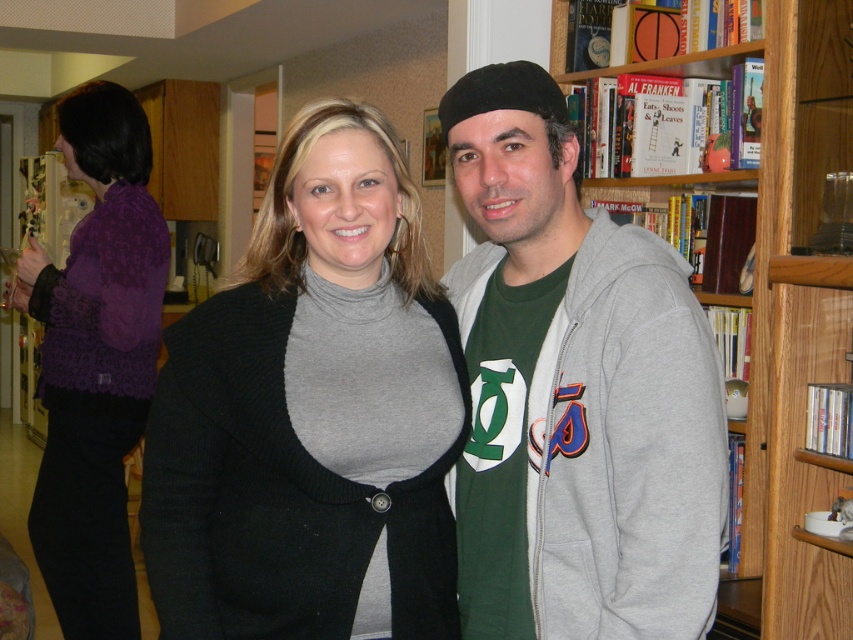
Question: Observing the image, what is the correct spatial positioning of wooden bookcase at right in reference to purple lace sweater at left?

Choices:
 (A) above
 (B) below

Answer: (A)

Question: Which point is closer to the camera taking this photo?

Choices:
 (A) (97, 340)
 (B) (579, 513)

Answer: (B)

Question: Is knit gray turtleneck at center smaller than wooden bookcase at right?

Choices:
 (A) yes
 (B) no

Answer: (A)

Question: Which of these objects is positioned closest to the purple lace sweater at left?

Choices:
 (A) wooden bookcase at right
 (B) knit gray turtleneck at center
 (C) green cotton t-shirt at center

Answer: (B)

Question: Does green cotton t-shirt at center appear on the left side of purple lace sweater at left?

Choices:
 (A) yes
 (B) no

Answer: (B)

Question: Which point is closer to the camera taking this photo?

Choices:
 (A) pyautogui.click(x=805, y=328)
 (B) pyautogui.click(x=524, y=484)

Answer: (B)